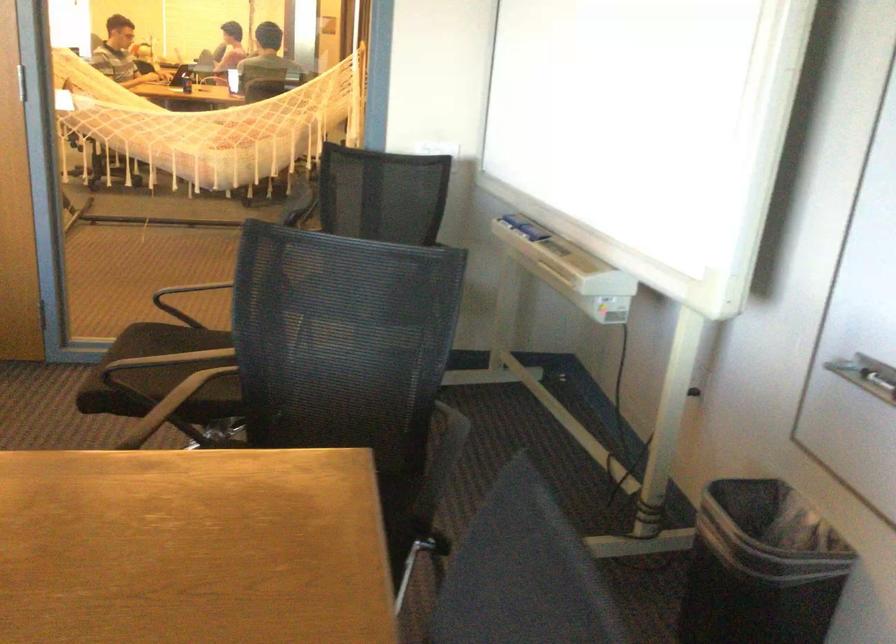
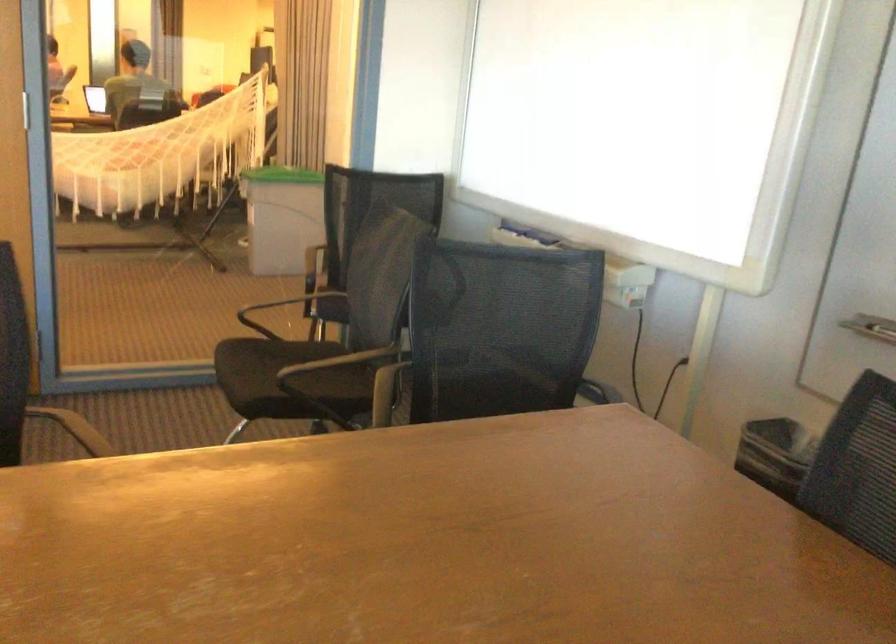
In the second image, find the point that corresponds to point (254, 142) in the first image.

(161, 156)